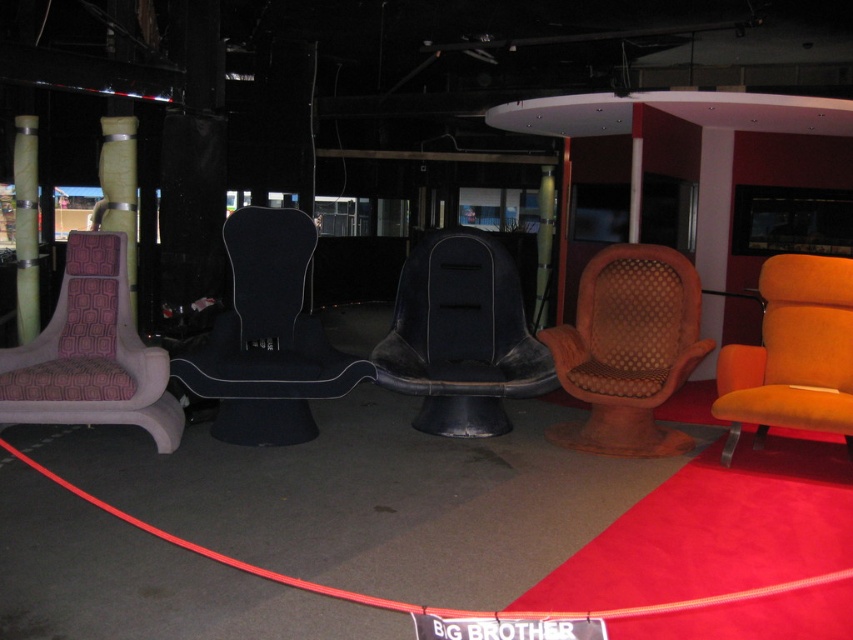
Is black fabric chair at center below orange velvet armchair at center?

No, black fabric chair at center is not below orange velvet armchair at center.

Between black fabric chair at center and orange velvet armchair at center, which one appears on the left side from the viewer's perspective?

black fabric chair at center is more to the left.

Does point (299, 358) lie in front of point (834, 276)?

Yes, it is.

You are a GUI agent. You are given a task and a screenshot of the screen. Output one action in this format:
    pyautogui.click(x=<x>, y=<y>)
    Task: Click on the black fabric chair at center
    The width and height of the screenshot is (853, 640).
    Given the screenshot: What is the action you would take?
    pyautogui.click(x=265, y=337)

Measure the distance between black leather chair at center and camera.

A distance of 14.45 feet exists between black leather chair at center and camera.

Does black leather chair at center appear on the right side of purple fabric armchair at left?

Yes, black leather chair at center is to the right of purple fabric armchair at left.

Is point (519, 307) more distant than point (85, 310)?

Yes, it is behind point (85, 310).

Locate an element on the screen. black leather chair at center is located at coordinates (461, 337).

Can you confirm if black fabric chair at center is bigger than brown woven armchair at center?

Indeed, black fabric chair at center has a larger size compared to brown woven armchair at center.

Locate an element on the screen. The height and width of the screenshot is (640, 853). black fabric chair at center is located at coordinates (265, 337).